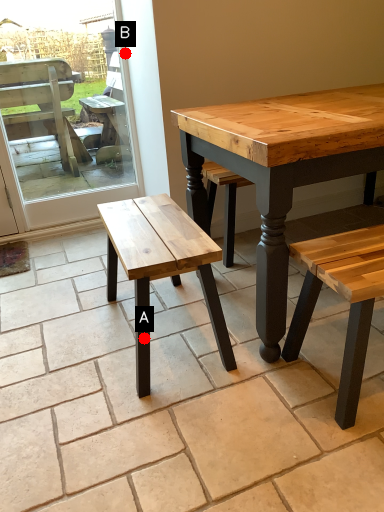
Question: Two points are circled on the image, labeled by A and B beside each circle. Which of the following is the closest to the observer?

Choices:
 (A) A is closer
 (B) B is closer

Answer: (A)